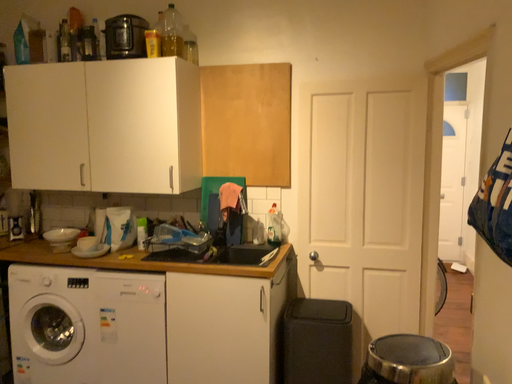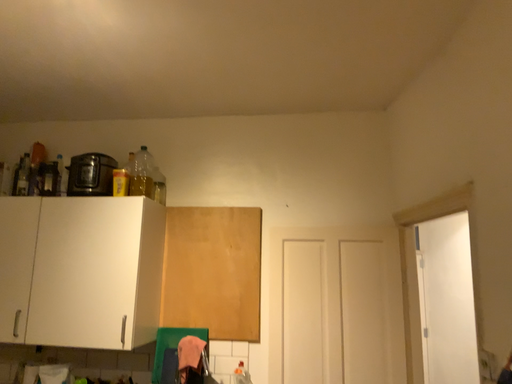
Question: How did the camera likely rotate when shooting the video?

Choices:
 (A) rotated right
 (B) rotated left

Answer: (A)